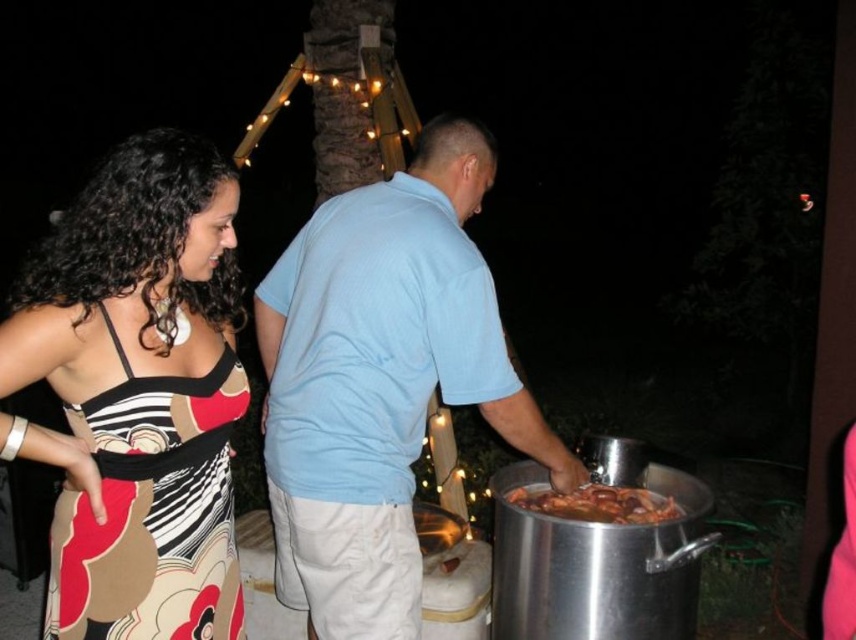
You are a photographer setting up for an outdoor event. You have a light blue cotton shirt at center and a shiny metallic food at lower right in your frame. Which object should you adjust your focus on if you want to capture the taller one?

The light blue cotton shirt at center is taller than the shiny metallic food at lower right, so you should focus on the light blue cotton shirt at center.

You are organizing a clothing display and need to arrange the printed fabric dress at left and the light blue cotton shirt at center side by side. Given their widths, which item should be placed on the narrower side of the display rack?

The printed fabric dress at left has a lesser width compared to the light blue cotton shirt at center, so it should be placed on the narrower side of the display rack.